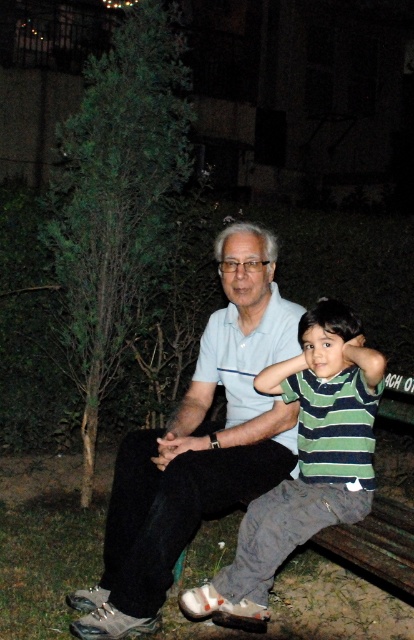
Who is more forward, (255, 228) or (351, 355)?

Point (351, 355) is more forward.

From the picture: Between light blue cotton shirt at center and striped cotton shirt at center, which one is positioned higher?

light blue cotton shirt at center

Is point (284, 456) positioned after point (315, 326)?

Yes, it is.

The image size is (414, 640). In order to click on light blue cotton shirt at center in this screenshot , I will do `click(199, 444)`.